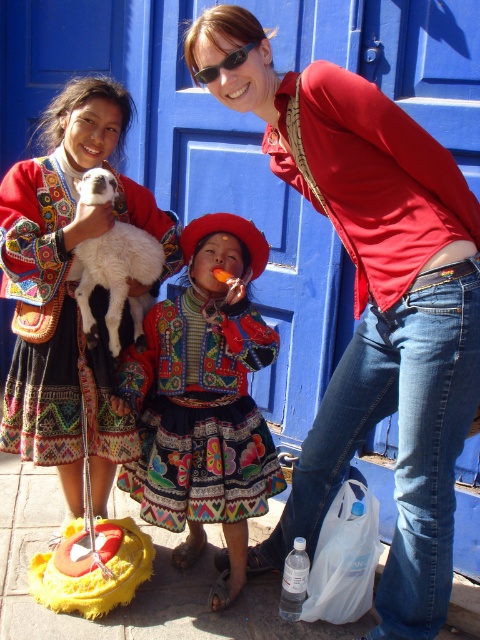
Question: Which object is farther from the camera taking this photo?

Choices:
 (A) white fluffy lamb at upper left
 (B) embroidered fabric dress at center
 (C) matte red shirt at upper right

Answer: (A)

Question: Does matte red shirt at upper right appear on the right side of white fluffy lamb at upper left?

Choices:
 (A) yes
 (B) no

Answer: (A)

Question: Which object appears closest to the camera in this image?

Choices:
 (A) embroidered fabric dress at center
 (B) white fluffy lamb at upper left
 (C) black plastic sunglasses at upper center
 (D) embroidered fabric dress at left

Answer: (C)

Question: Where is embroidered fabric dress at center located in relation to black plastic sunglasses at upper center in the image?

Choices:
 (A) above
 (B) below

Answer: (B)

Question: Which point is farther to the camera?

Choices:
 (A) (99, 278)
 (B) (160, 388)

Answer: (B)

Question: Does embroidered fabric dress at left have a lesser width compared to black plastic sunglasses at upper center?

Choices:
 (A) no
 (B) yes

Answer: (A)